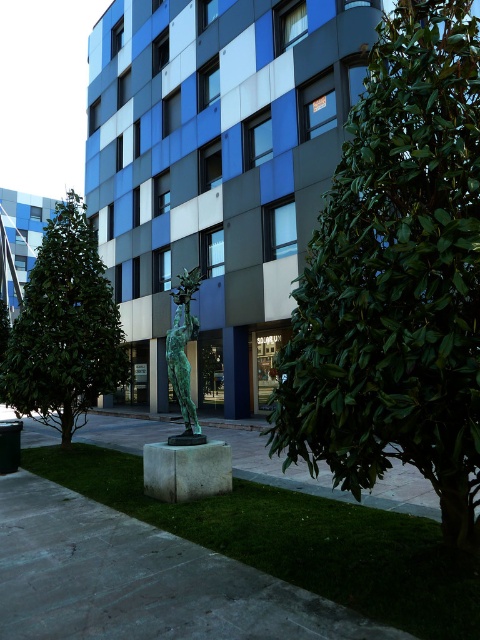
Question: Which point appears farthest from the camera in this image?

Choices:
 (A) (439, 292)
 (B) (45, 356)

Answer: (B)

Question: Can you confirm if green leafy tree at right is positioned above green bronze statue at center?

Choices:
 (A) no
 (B) yes

Answer: (B)

Question: Which point appears farthest from the camera in this image?

Choices:
 (A) (11, 346)
 (B) (312, 316)

Answer: (A)

Question: Is green leafy tree at right positioned behind green bronze statue at center?

Choices:
 (A) yes
 (B) no

Answer: (B)

Question: Is green leafy tree at left positioned before green bronze statue at center?

Choices:
 (A) no
 (B) yes

Answer: (A)

Question: Based on their relative distances, which object is farther from the green leafy tree at right?

Choices:
 (A) green leafy tree at left
 (B) green bronze statue at center

Answer: (A)